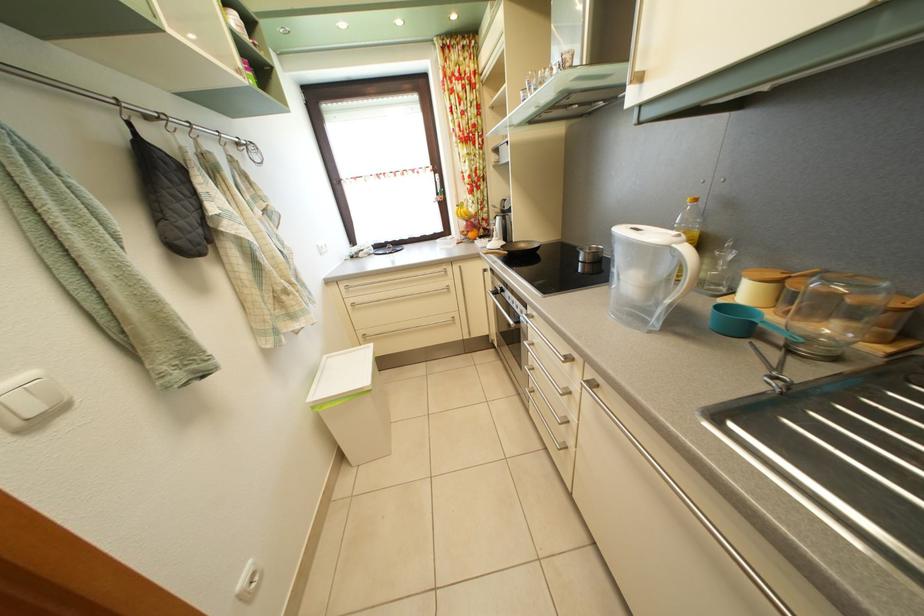
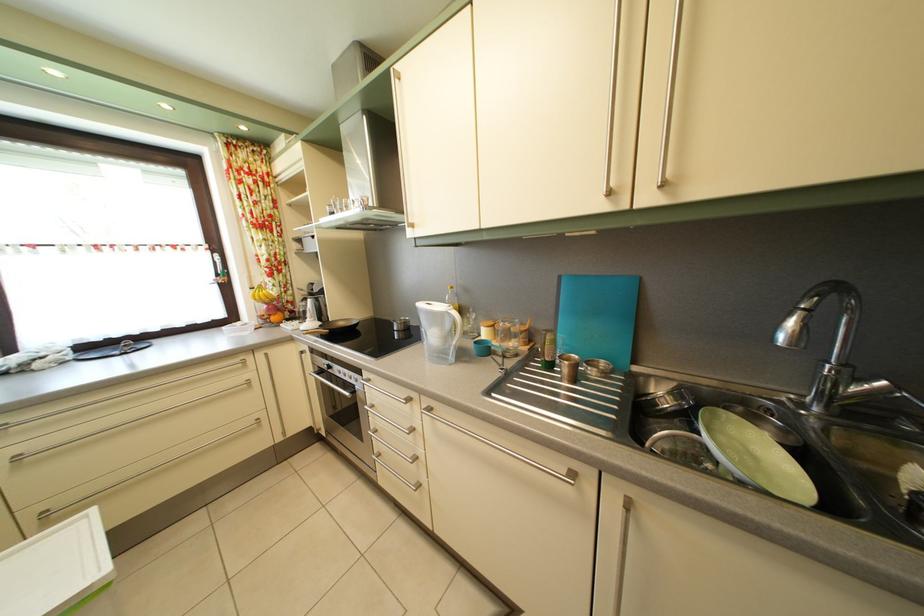
Where in the second image is the point corresponding to the point at 602,392 from the first image?

(438, 416)